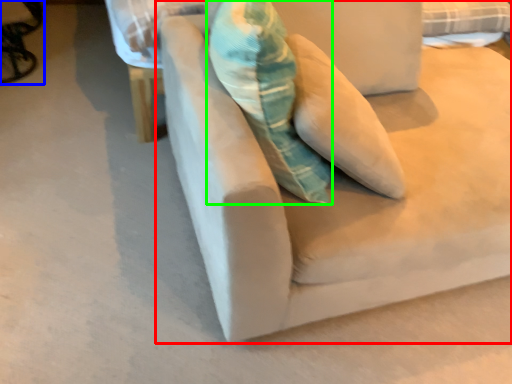
Question: Which object is positioned farthest from studio couch (highlighted by a red box)? Select from swivel chair (highlighted by a blue box) and throw pillow (highlighted by a green box).

Choices:
 (A) swivel chair
 (B) throw pillow

Answer: (A)